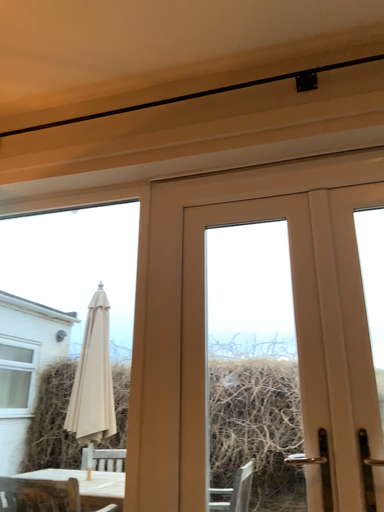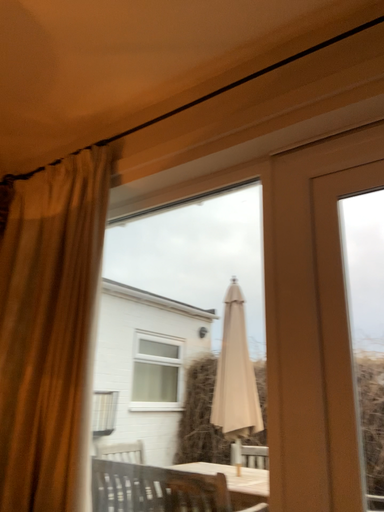
Question: How did the camera likely rotate when shooting the video?

Choices:
 (A) rotated right
 (B) rotated left

Answer: (B)